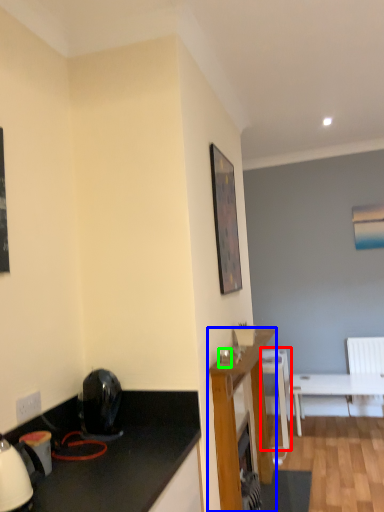
Question: Which object is the closest to the chair (highlighted by a red box)? Choose among these: cabinetry (highlighted by a blue box) or coffee cup (highlighted by a green box).

Choices:
 (A) cabinetry
 (B) coffee cup

Answer: (A)